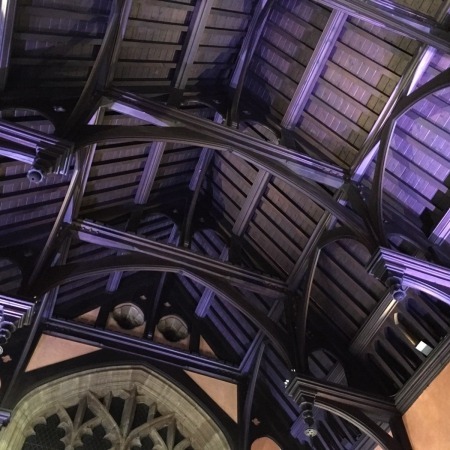
I want to click on light, so click(425, 263).